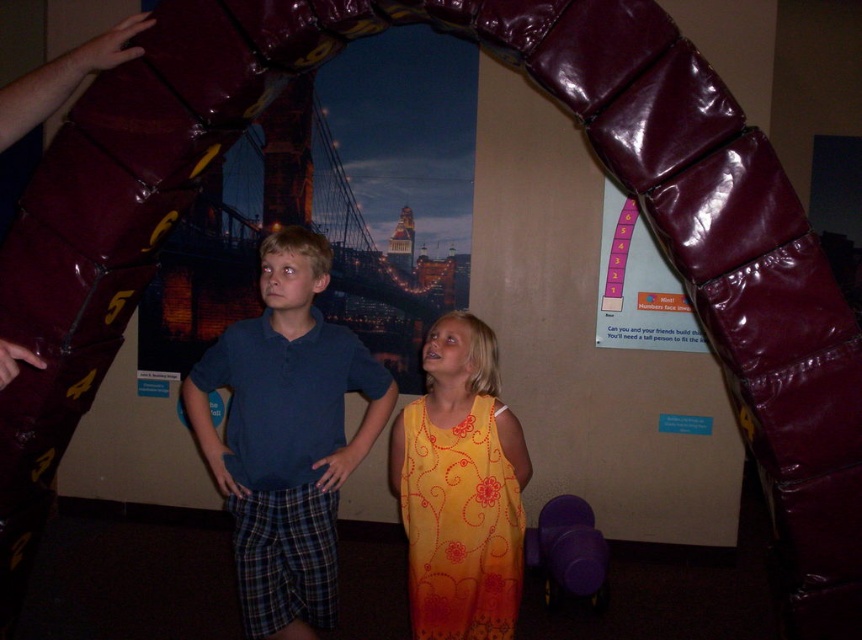
Looking at this image, you are a visitor at an interactive exhibit and want to know if the point at coordinate (329, 413) is closer to you than the point at (311, 400). Based on the scene description, can you determine this?

Point (329, 413) is behind point (311, 400), so no, it is not closer to you.

You are a tailor measuring shirts for a customer. You have two shirts in front of you, the blue cotton shirt at center and the matte blue polo shirt at center. Which shirt has a larger width?

The blue cotton shirt at center has a larger width than the matte blue polo shirt at center according to the description.

You are a photographer trying to capture a group photo of the blue cotton shirt at center and the yellow floral dress at center. The minimum distance required for your camera to focus properly is 12 inches. Based on the scene, will the camera be able to focus on both subjects clearly?

The blue cotton shirt at center is 13.18 inches from the yellow floral dress at center. Since the distance between them is greater than the camera minimum focusing distance of 12 inches, the camera should be able to focus on both subjects clearly.